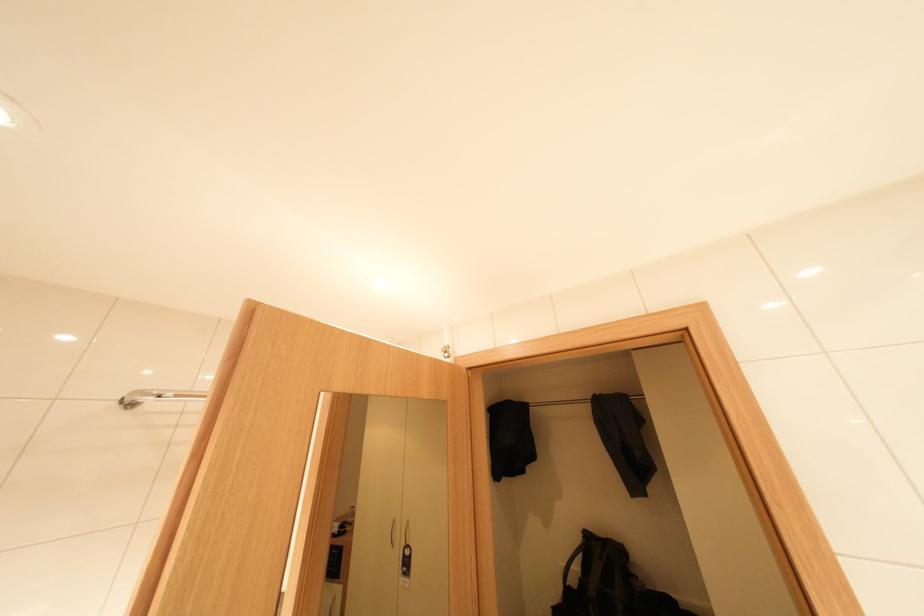
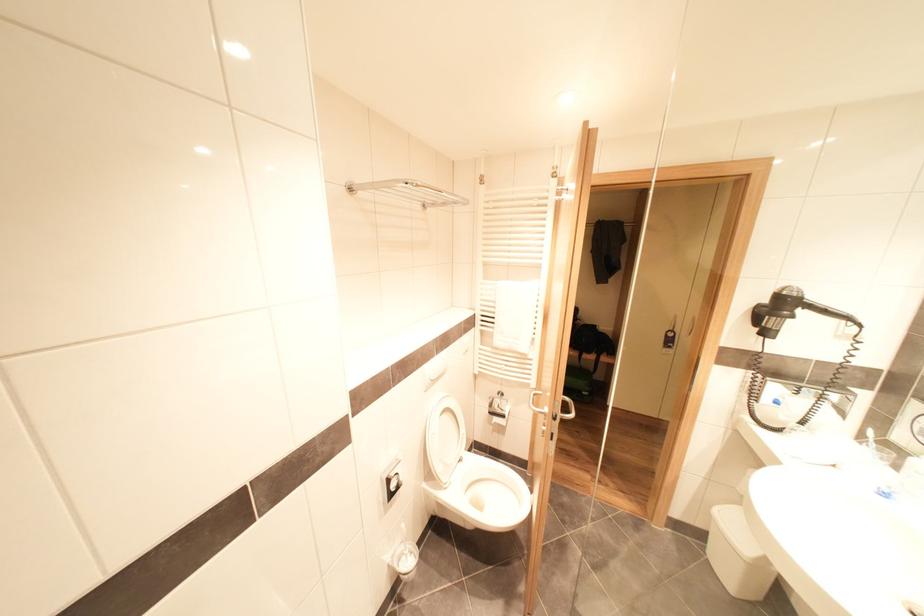
The first image is from the beginning of the video and the second image is from the end. How did the camera likely rotate when shooting the video?

The rotation direction of the camera is right-down.